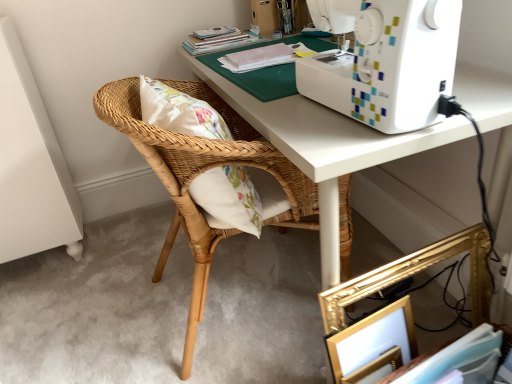
The image size is (512, 384). I want to click on vacant space situated on the left part of white plastic sewing machine at upper right, so (x=301, y=115).